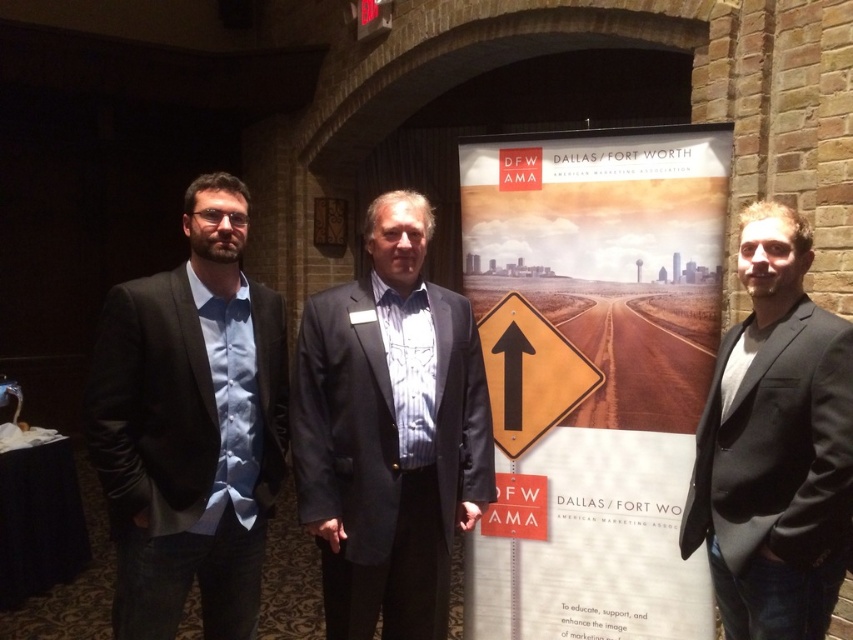
You are standing in front of the DFW AMA promotional banner. There is a point at coordinates point (x=573, y=144). Can you reach this point with your hand if you extend it fully?

The point at (x=573, y=144) is 2.42 meters away from you. Since the average human arm length is about 0.7 meters, you cannot reach it with your hand.

From the picture: You are a photographer setting up for a group photo. You notice the matte black suit at left and the dark gray suit at center in the scene. Which of these two suits is positioned higher from the ground?

The matte black suit at left is located above the dark gray suit at center, so it is positioned higher from the ground.